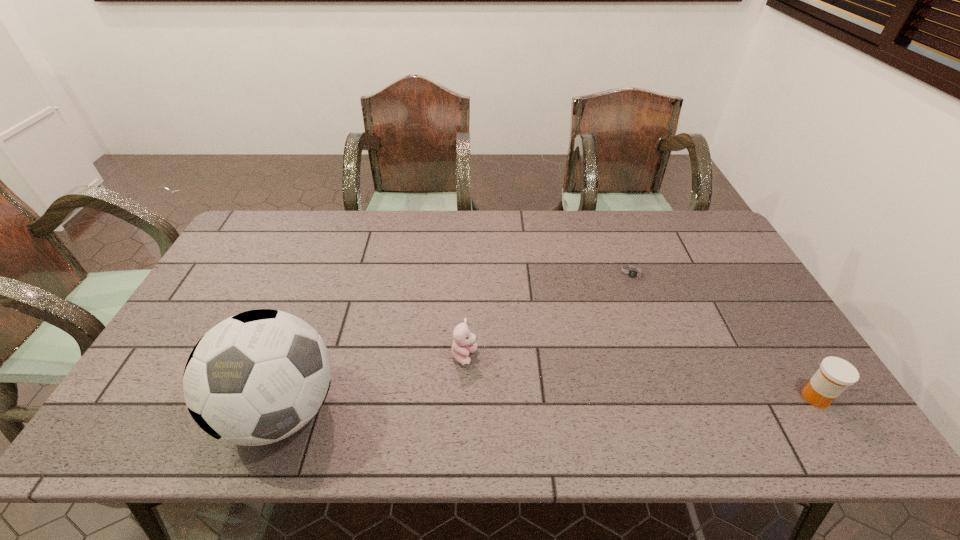
Where is `the leftmost object`? This screenshot has height=540, width=960. the leftmost object is located at coordinates (257, 377).

At what (x,y) coordinates should I click in order to perform the action: click on the tallest object. Please return your answer as a coordinate pair (x, y). Looking at the image, I should click on (257, 377).

Find the location of a particular element. This screenshot has width=960, height=540. the rightmost object is located at coordinates (835, 374).

Where is `the second object from left to right`? The height and width of the screenshot is (540, 960). the second object from left to right is located at coordinates (464, 343).

Where is `the farthest object`? This screenshot has height=540, width=960. the farthest object is located at coordinates coord(630,272).

You are a GUI agent. You are given a task and a screenshot of the screen. Output one action in this format:
    pyautogui.click(x=<x>, y=<y>)
    Task: Click on the watch
    Image resolution: width=960 pixels, height=540 pixels.
    Given the screenshot: What is the action you would take?
    pyautogui.click(x=630, y=272)

Image resolution: width=960 pixels, height=540 pixels. Identify the location of free space located 0.140m at the face of the teddy bear. (517, 396).

Where is `blank area located 0.100m at the face of the teddy bear`? The width and height of the screenshot is (960, 540). blank area located 0.100m at the face of the teddy bear is located at coordinates click(504, 387).

In order to click on free space located 0.120m at the face of the teddy bear in this screenshot , I will do `click(511, 392)`.

Identify the location of vacant space located 0.160m on the face of the watch. This screenshot has width=960, height=540. (630, 323).